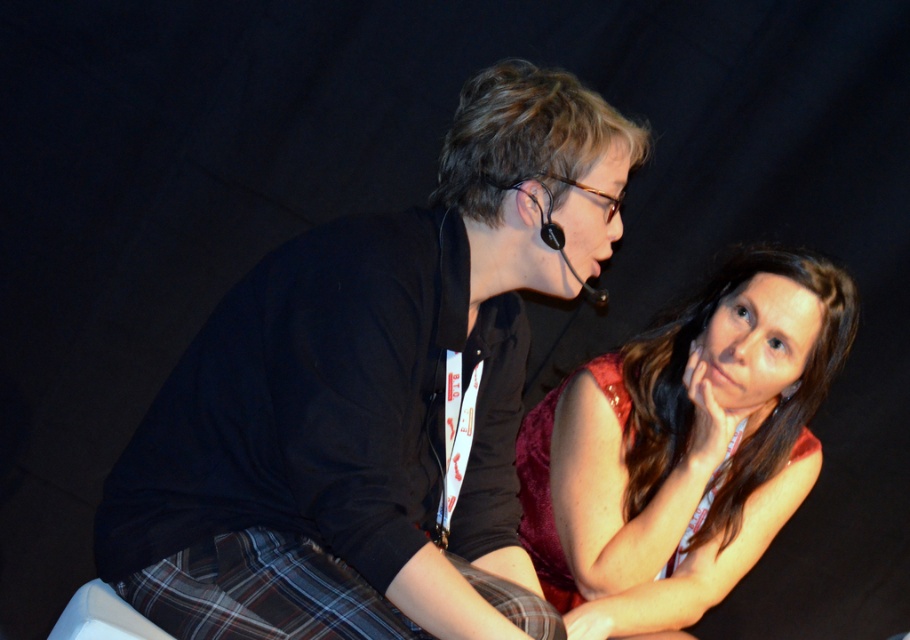
Question: Which object is the closest to the plaid fabric kilt at lower left?

Choices:
 (A) black matte shirt at center
 (B) matte red dress at center

Answer: (A)

Question: Where is black matte shirt at center located in relation to plaid fabric kilt at lower left in the image?

Choices:
 (A) below
 (B) above

Answer: (B)

Question: Based on their relative distances, which object is nearer to the matte red dress at center?

Choices:
 (A) plaid fabric kilt at lower left
 (B) black matte shirt at center

Answer: (B)

Question: Considering the real-world distances, which object is farthest from the black matte shirt at center?

Choices:
 (A) matte red dress at center
 (B) plaid fabric kilt at lower left

Answer: (A)

Question: Is matte red dress at center positioned before plaid fabric kilt at lower left?

Choices:
 (A) no
 (B) yes

Answer: (A)

Question: Is matte red dress at center bigger than plaid fabric kilt at lower left?

Choices:
 (A) no
 (B) yes

Answer: (B)